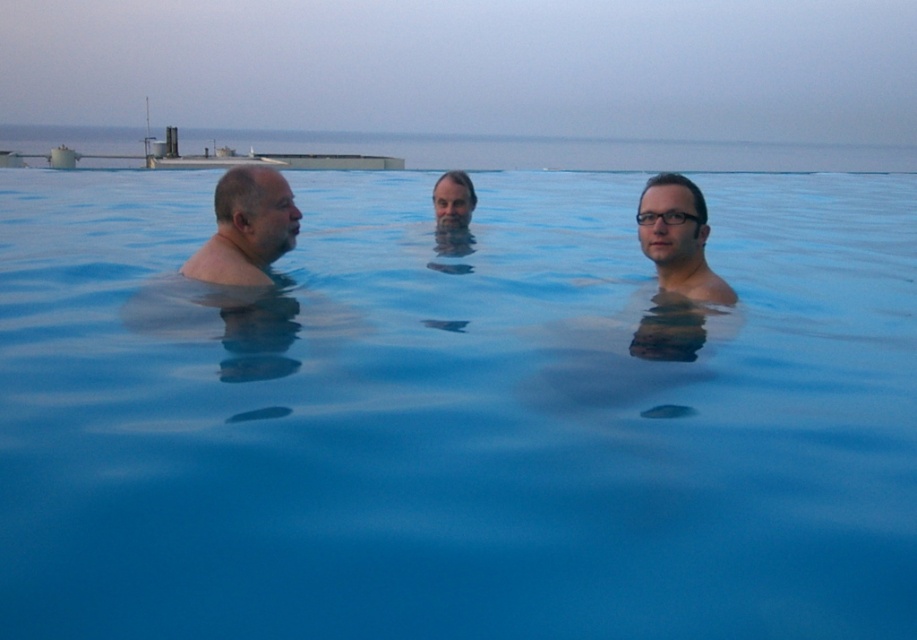
You are a photographer trying to capture a clear shot of the matte black hair at center and the clear plastic glasses at center. If the camera can only focus on objects within a 10 cm width, will both objects fit within the frame?

The matte black hair at center might be wider than clear plastic glasses at center, so it is possible that the total width of both objects exceeds the camera frame limit of 10 cm. Therefore, both objects may not fit within the frame.

You are a photographer taking a portrait of the two people in the water. You want to ensure that the smooth skin head at left and the matte black hair at center are both clearly visible in the reflection. Which person should you focus on first to capture their reflection properly?

The smooth skin head at left is positioned on the left side of matte black hair at center, so you should focus on the smooth skin head at left first to ensure their reflection is captured properly before moving to the matte black hair at center.

You are a photographer trying to capture the reflection of the matte black hair at center in the water. Based on the scene description, where should you position your camera to ensure the reflection is clearly visible?

The matte black hair at center is located at point (678, 237), so you should position your camera directly above that point to capture its reflection clearly.